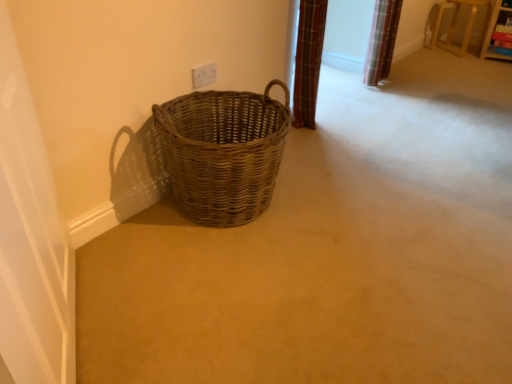
The image size is (512, 384). What do you see at coordinates (31, 238) in the screenshot?
I see `white glossy screen door at left` at bounding box center [31, 238].

Image resolution: width=512 pixels, height=384 pixels. Describe the element at coordinates (204, 75) in the screenshot. I see `white plastic electric outlet at upper center` at that location.

Identify the location of white glossy screen door at left. 31,238.

The width and height of the screenshot is (512, 384). What are the coordinates of `screen door located below the white plastic electric outlet at upper center (from the image's perspective)` in the screenshot? It's located at (31, 238).

Can you tell me how much white plastic electric outlet at upper center and white glossy screen door at left differ in facing direction?

57.1 degrees separate the facing orientations of white plastic electric outlet at upper center and white glossy screen door at left.

Does white plastic electric outlet at upper center lie behind white glossy screen door at left?

Yes, white plastic electric outlet at upper center is further from the camera.

Does point (211, 71) come in front of point (66, 321)?

That is False.

Does woven brown basket at lower left have a lesser width compared to white glossy screen door at left?

Incorrect, the width of woven brown basket at lower left is not less than that of white glossy screen door at left.

Is woven brown basket at lower left in contact with white glossy screen door at left?

woven brown basket at lower left is not next to white glossy screen door at left, and they're not touching.

Based on the photo, considering the positions of objects woven brown basket at lower left and white glossy screen door at left in the image provided, who is more to the right, woven brown basket at lower left or white glossy screen door at left?

woven brown basket at lower left.

Which of these two, woven brown basket at lower left or white glossy screen door at left, is smaller?

Smaller between the two is white glossy screen door at left.

Can you tell me how much white plastic electric outlet at upper center and woven brown basket at lower left differ in facing direction?

The angle between the facing direction of white plastic electric outlet at upper center and the facing direction of woven brown basket at lower left is 0.2 degrees.

Who is smaller, white plastic electric outlet at upper center or woven brown basket at lower left?

Smaller between the two is white plastic electric outlet at upper center.

Which object is further away from the camera taking this photo, white plastic electric outlet at upper center or woven brown basket at lower left?

white plastic electric outlet at upper center is more distant.

From the image's perspective, which one is positioned higher, white plastic electric outlet at upper center or woven brown basket at lower left?

white plastic electric outlet at upper center, from the image's perspective.

Is point (14, 223) positioned before point (219, 222)?

That is True.

Identify the location of screen door that appears above the woven brown basket at lower left (from a real-world perspective). (31, 238).

Is woven brown basket at lower left located within white glossy screen door at left?

That's incorrect, woven brown basket at lower left is not inside white glossy screen door at left.

Is there a large distance between white glossy screen door at left and woven brown basket at lower left?

No, white glossy screen door at left is in close proximity to woven brown basket at lower left.

Is woven brown basket at lower left taller than white plastic electric outlet at upper center?

Yes.

Between woven brown basket at lower left and white plastic electric outlet at upper center, which one has smaller width?

white plastic electric outlet at upper center is thinner.

Would you say woven brown basket at lower left is a long distance from white plastic electric outlet at upper center?

Actually, woven brown basket at lower left and white plastic electric outlet at upper center are a little close together.

Can you confirm if white glossy screen door at left is thinner than white plastic electric outlet at upper center?

No.

Where is `electric outlet located underneath the white glossy screen door at left (from a real-world perspective)`? electric outlet located underneath the white glossy screen door at left (from a real-world perspective) is located at coordinates point(204,75).

Considering the relative sizes of white glossy screen door at left and white plastic electric outlet at upper center in the image provided, is white glossy screen door at left bigger than white plastic electric outlet at upper center?

Indeed, white glossy screen door at left has a larger size compared to white plastic electric outlet at upper center.

Between white glossy screen door at left and white plastic electric outlet at upper center, which one is positioned behind?

white plastic electric outlet at upper center is more distant.

Identify the location of screen door that is above the white plastic electric outlet at upper center (from a real-world perspective). This screenshot has height=384, width=512. (31, 238).

Find the location of a particular element. screen door in front of the woven brown basket at lower left is located at coordinates (31, 238).

Considering their positions, is woven brown basket at lower left positioned closer to white glossy screen door at left than white plastic electric outlet at upper center?

Based on the image, woven brown basket at lower left appears to be nearer to white glossy screen door at left.

Estimate the real-world distances between objects in this image. Which object is further from white plastic electric outlet at upper center, white glossy screen door at left or woven brown basket at lower left?

Based on the image, white glossy screen door at left appears to be further to white plastic electric outlet at upper center.

Looking at the image, which one is located closer to white glossy screen door at left, white plastic electric outlet at upper center or woven brown basket at lower left?

Among the two, woven brown basket at lower left is located nearer to white glossy screen door at left.

Considering their positions, is white glossy screen door at left positioned closer to woven brown basket at lower left than white plastic electric outlet at upper center?

Based on the image, white plastic electric outlet at upper center appears to be nearer to woven brown basket at lower left.

Looking at the image, which one is located closer to white plastic electric outlet at upper center, woven brown basket at lower left or white glossy screen door at left?

The object closer to white plastic electric outlet at upper center is woven brown basket at lower left.

When comparing their distances from woven brown basket at lower left, does white plastic electric outlet at upper center or white glossy screen door at left seem closer?

white plastic electric outlet at upper center lies closer to woven brown basket at lower left than the other object.

Find the location of `picnic basket located between white glossy screen door at left and white plastic electric outlet at upper center in the depth direction`. picnic basket located between white glossy screen door at left and white plastic electric outlet at upper center in the depth direction is located at coordinates (223, 152).